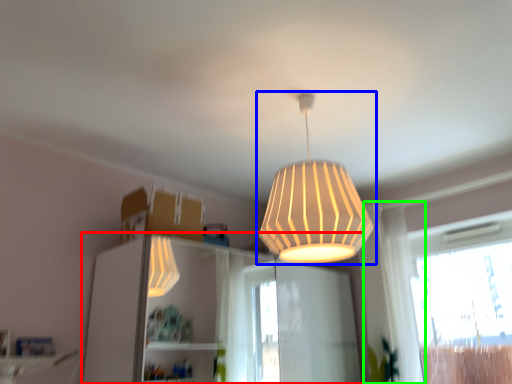
Question: Which object is the closest to the dresser (highlighted by a red box)? Choose among these: lamp (highlighted by a blue box) or curtain (highlighted by a green box).

Choices:
 (A) lamp
 (B) curtain

Answer: (B)